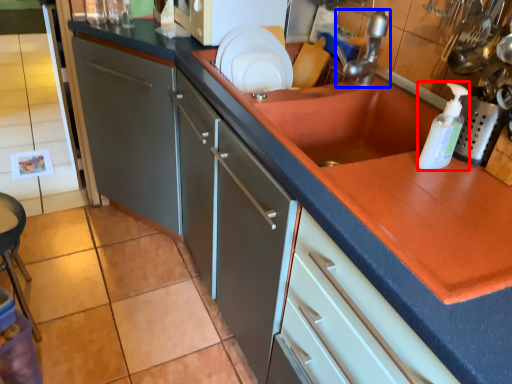
Question: Which of the following is the closest to the observer, bottle (highlighted by a red box) or tap (highlighted by a blue box)?

Choices:
 (A) bottle
 (B) tap

Answer: (A)